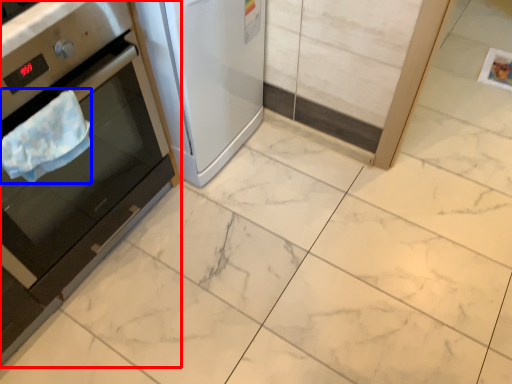
Question: Which object is further to the camera taking this photo, home appliance (highlighted by a red box) or blanket (highlighted by a blue box)?

Choices:
 (A) home appliance
 (B) blanket

Answer: (B)